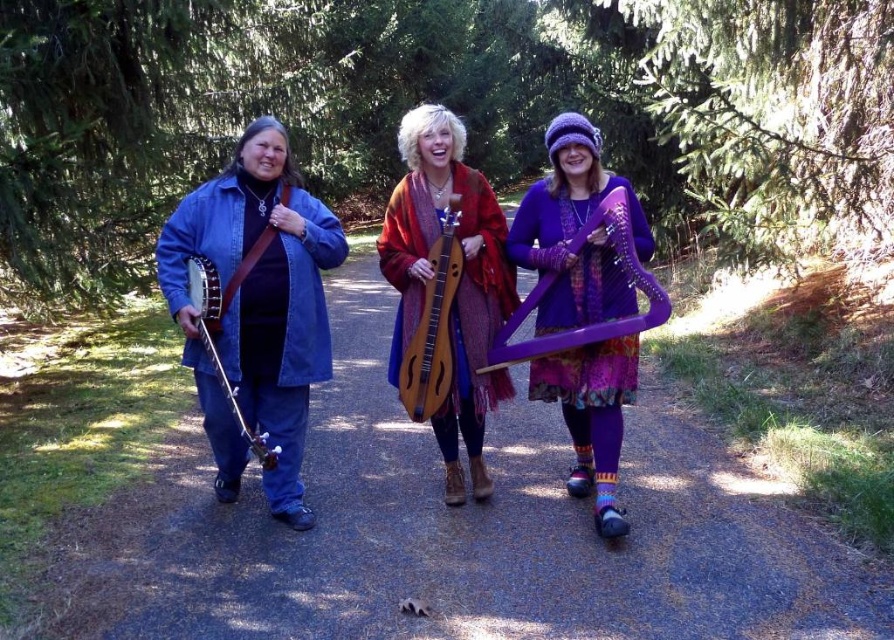
Between gravel path at center and denim jacket at left, which one is positioned higher?

denim jacket at left is above.

Is gravel path at center further to the viewer compared to denim jacket at left?

That is False.

Is point (200, 545) less distant than point (270, 493)?

That is True.

At what (x,y) coordinates should I click in order to perform the action: click on gravel path at center. Please return your answer as a coordinate pair (x, y). This screenshot has height=640, width=894. Looking at the image, I should click on (406, 518).

Can you confirm if purple knitted hat at upper center is positioned below wooden dulcimer at center?

Yes, purple knitted hat at upper center is below wooden dulcimer at center.

Who is positioned more to the right, purple knitted hat at upper center or wooden dulcimer at center?

Positioned to the right is purple knitted hat at upper center.

Describe the element at coordinates (575, 234) in the screenshot. I see `purple knitted hat at upper center` at that location.

This screenshot has width=894, height=640. In order to click on purple knitted hat at upper center in this screenshot , I will do `click(575, 234)`.

Does denim jacket at left appear under purple knitted hat at upper center?

Indeed, denim jacket at left is positioned under purple knitted hat at upper center.

Who is shorter, denim jacket at left or purple knitted hat at upper center?

With less height is denim jacket at left.

Describe the element at coordinates (256, 308) in the screenshot. I see `denim jacket at left` at that location.

Find the location of `denim jacket at left`. denim jacket at left is located at coordinates click(256, 308).